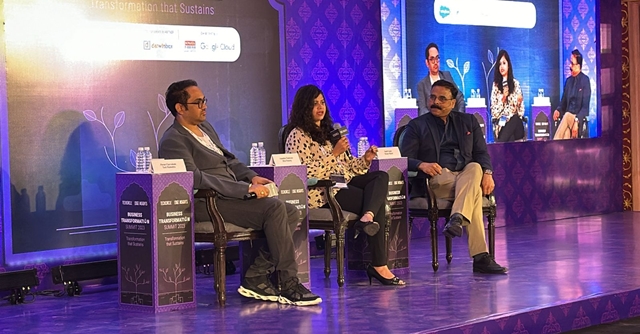
Find the location of a particular element. This screenshot has width=640, height=334. floor is located at coordinates (500, 307).